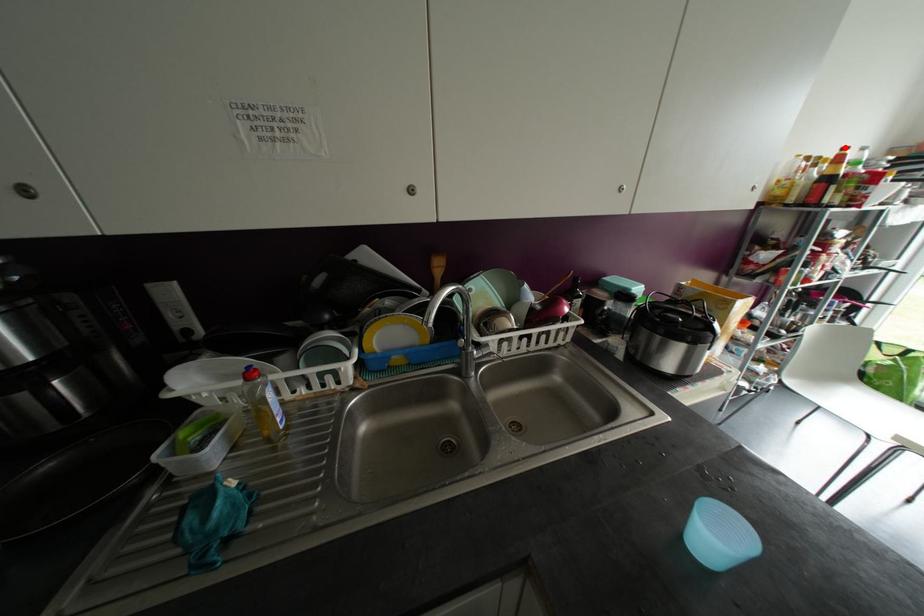
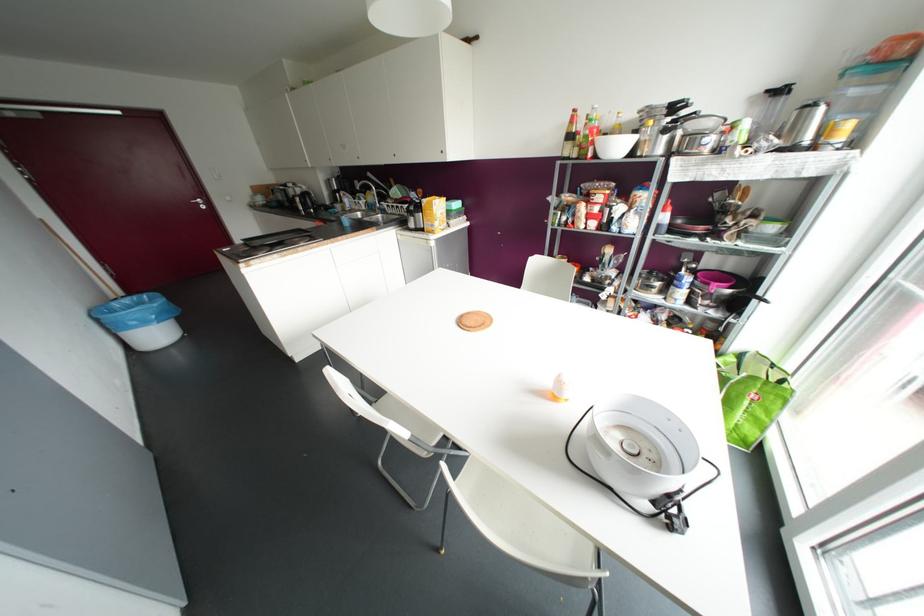
The point at the highlighted location is marked in the first image. Where is the corresponding point in the second image?

(574, 110)